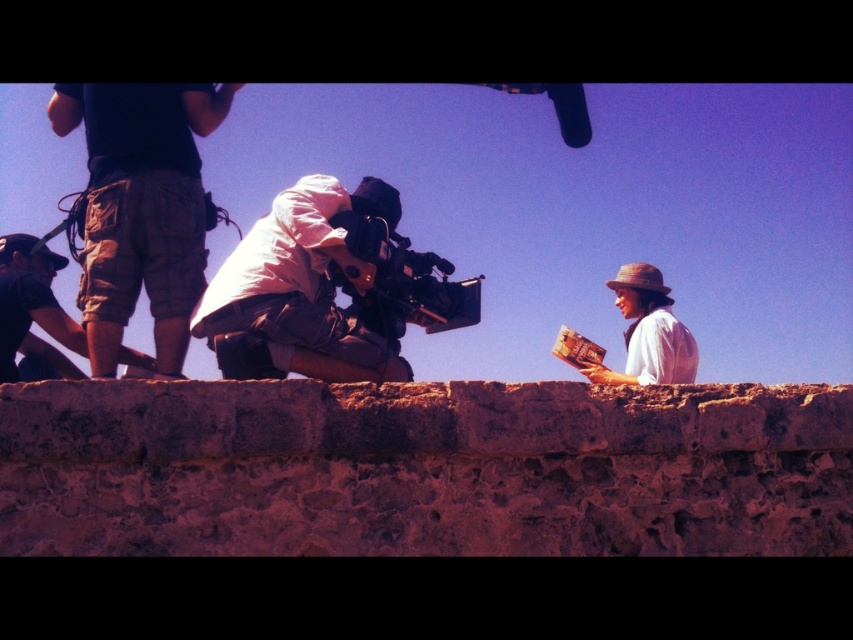
What do you see at coordinates (404, 280) in the screenshot?
I see `black matte video camera at center` at bounding box center [404, 280].

Is black matte video camera at center positioned behind matte straw hat at right?

No.

Between point (383, 220) and point (663, 372), which one is positioned in front?

Point (383, 220) is more forward.

The image size is (853, 640). What are the coordinates of `black matte video camera at center` in the screenshot? It's located at (404, 280).

Does dark blue t-shirt at left appear on the right side of matte white camera at center?

Incorrect, dark blue t-shirt at left is not on the right side of matte white camera at center.

What do you see at coordinates (141, 208) in the screenshot? This screenshot has width=853, height=640. I see `dark blue t-shirt at left` at bounding box center [141, 208].

Identify the location of dark blue t-shirt at left. (141, 208).

This screenshot has height=640, width=853. What are the coordinates of `dark blue t-shirt at left` in the screenshot? It's located at (141, 208).

Is dark blue t-shirt at left thinner than matte straw hat at right?

Yes.

At what (x,y) coordinates should I click in order to perform the action: click on dark blue t-shirt at left. Please return your answer as a coordinate pair (x, y). This screenshot has width=853, height=640. Looking at the image, I should click on (141, 208).

Where is `dark blue t-shirt at left`? The width and height of the screenshot is (853, 640). dark blue t-shirt at left is located at coordinates (141, 208).

At what (x,y) coordinates should I click in order to perform the action: click on dark blue t-shirt at left. Please return your answer as a coordinate pair (x, y). The image size is (853, 640). Looking at the image, I should click on (141, 208).